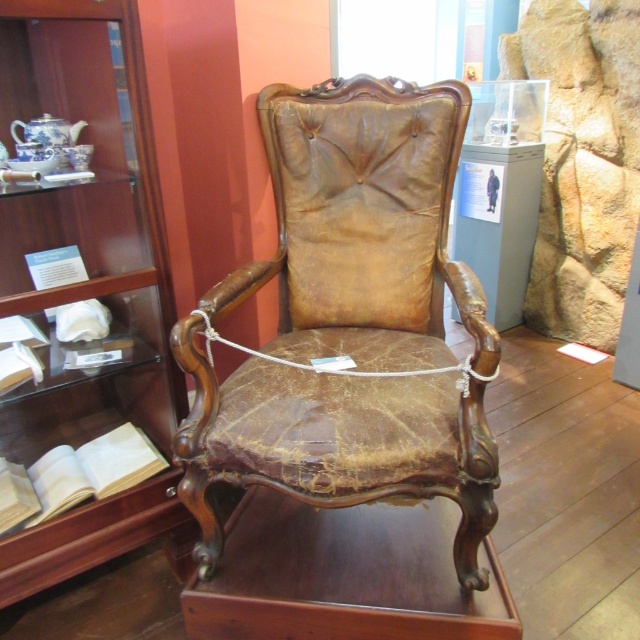
Is wooden bookshelf at center wider than light brown paper book at lower left?

Correct, the width of wooden bookshelf at center exceeds that of light brown paper book at lower left.

Can you confirm if wooden bookshelf at center is thinner than light brown paper book at lower left?

No.

What do you see at coordinates (88, 224) in the screenshot?
I see `wooden bookshelf at center` at bounding box center [88, 224].

The height and width of the screenshot is (640, 640). Find the location of `wooden bookshelf at center`. wooden bookshelf at center is located at coordinates (88, 224).